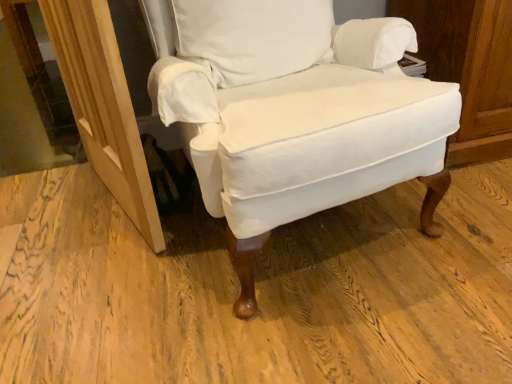
Locate an element on the screen. The image size is (512, 384). blank space to the left of wooden screen door at lower left is located at coordinates (51, 202).